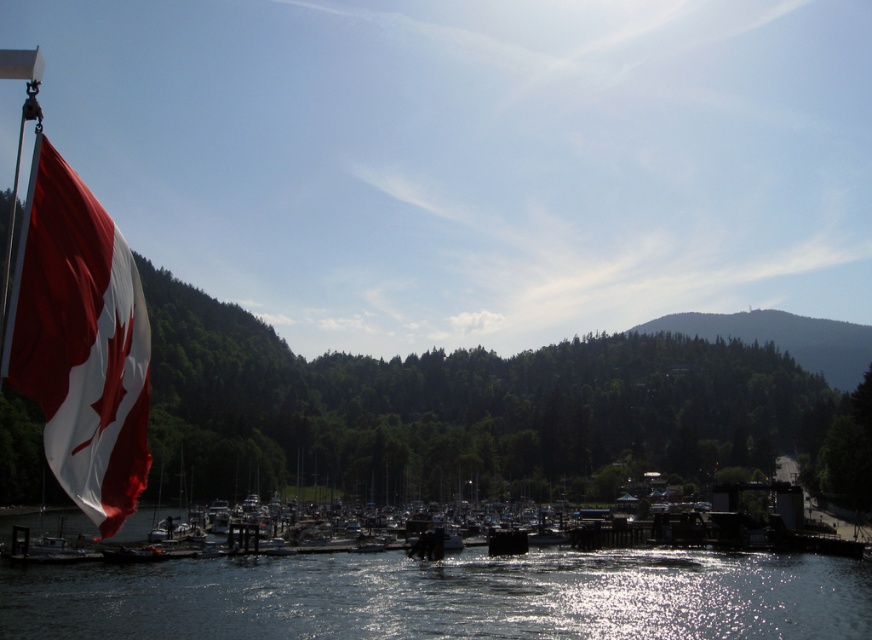
Question: Which of the following is the farthest from the observer?

Choices:
 (A) red fabric flag at left
 (B) transparent water at center

Answer: (B)

Question: Among these points, which one is nearest to the camera?

Choices:
 (A) (528, 563)
 (B) (24, 225)

Answer: (B)

Question: Where is transparent water at center located in relation to red fabric flag at left in the image?

Choices:
 (A) above
 (B) below

Answer: (B)

Question: Is transparent water at center bigger than red fabric flag at left?

Choices:
 (A) no
 (B) yes

Answer: (B)

Question: Does transparent water at center appear on the left side of red fabric flag at left?

Choices:
 (A) yes
 (B) no

Answer: (A)